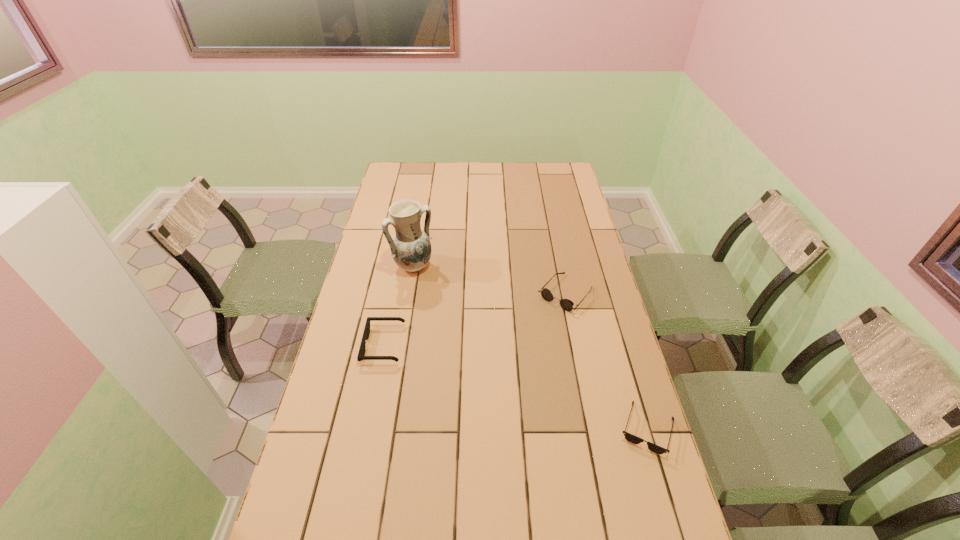
Where is `free space located 0.100m on the front-facing side of the farthest sunglasses`? free space located 0.100m on the front-facing side of the farthest sunglasses is located at coordinates (535, 328).

Where is `free spot located 0.330m on either side of the pottery`? free spot located 0.330m on either side of the pottery is located at coordinates (478, 332).

Find the location of a particular element. free location located on either side of the pottery is located at coordinates (462, 315).

Locate an element on the screen. The width and height of the screenshot is (960, 540). free space located 0.360m on either side of the pottery is located at coordinates pyautogui.click(x=483, y=337).

Image resolution: width=960 pixels, height=540 pixels. In order to click on sunglasses that is at the left edge in this screenshot , I will do `click(361, 356)`.

Where is `pottery situated at the left edge`? The image size is (960, 540). pottery situated at the left edge is located at coordinates (410, 247).

Where is `vacant space at the far edge of the desktop`? The width and height of the screenshot is (960, 540). vacant space at the far edge of the desktop is located at coordinates (436, 171).

Image resolution: width=960 pixels, height=540 pixels. In order to click on vacant area at the near edge in this screenshot , I will do `click(438, 523)`.

Image resolution: width=960 pixels, height=540 pixels. Find the location of `vacant region at the left edge of the desktop`. vacant region at the left edge of the desktop is located at coordinates (346, 335).

Find the location of a particular element. free space at the right edge is located at coordinates (633, 386).